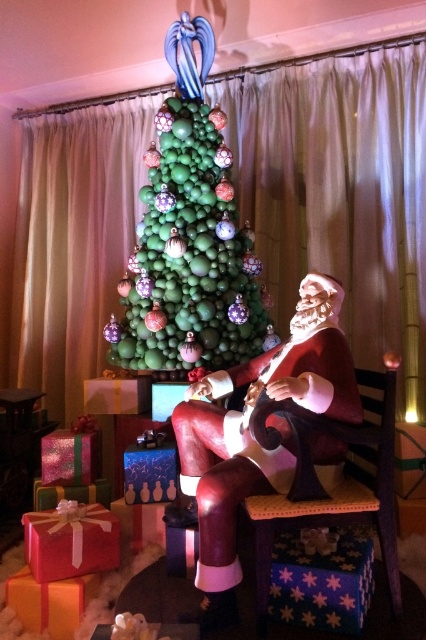
Question: Among these objects, which one is nearest to the camera?

Choices:
 (A) shiny red gift at lower left
 (B) matte red santa at center
 (C) wooden textured chair at center
 (D) green matte ornaments at center

Answer: (B)

Question: Does matte red santa at center lie in front of shiny red gift at lower left?

Choices:
 (A) yes
 (B) no

Answer: (A)

Question: Which object is the closest to the shiny red gift at lower left?

Choices:
 (A) green matte ornaments at center
 (B) matte red santa at center
 (C) wooden textured chair at center

Answer: (B)

Question: Is green matte ornaments at center closer to the viewer compared to shiny red gift at lower left?

Choices:
 (A) yes
 (B) no

Answer: (B)

Question: Does green matte ornaments at center appear over matte red santa at center?

Choices:
 (A) no
 (B) yes

Answer: (B)

Question: Which of the following is the farthest from the observer?

Choices:
 (A) (371, 412)
 (B) (253, 388)

Answer: (B)